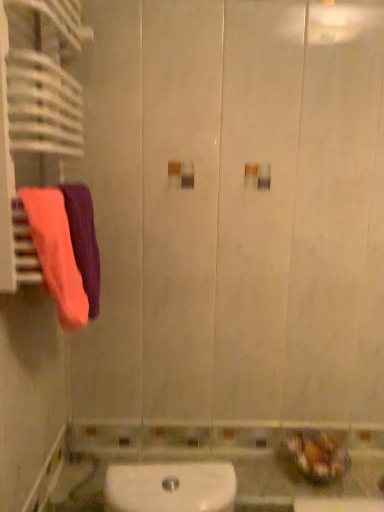
Image resolution: width=384 pixels, height=512 pixels. What do you see at coordinates (56, 254) in the screenshot?
I see `fluffy cotton towel at left, arranged as the first towel when viewed from the front` at bounding box center [56, 254].

At what (x,y) coordinates should I click in order to perform the action: click on fluffy cotton towel at left, arranged as the first towel when viewed from the front. Please return your answer as a coordinate pair (x, y). This screenshot has height=512, width=384. Looking at the image, I should click on (56, 254).

Where is `orange fabric towel at left, arranged as the 1th towel when viewed from the back`? Image resolution: width=384 pixels, height=512 pixels. orange fabric towel at left, arranged as the 1th towel when viewed from the back is located at coordinates (84, 240).

What do you see at coordinates (84, 240) in the screenshot? I see `orange fabric towel at left, the second towel viewed from the front` at bounding box center [84, 240].

In order to click on fluffy cotton towel at left, which is counted as the second towel, starting from the back in this screenshot , I will do `click(56, 254)`.

Is fluffy cotton towel at left, which is counted as the second towel, starting from the back, at the left side of orange fabric towel at left, arranged as the 1th towel when viewed from the back?

Indeed, fluffy cotton towel at left, which is counted as the second towel, starting from the back, is positioned on the left side of orange fabric towel at left, arranged as the 1th towel when viewed from the back.

From the picture: Is fluffy cotton towel at left, which is counted as the second towel, starting from the back, further to the viewer compared to orange fabric towel at left, the second towel viewed from the front?

No, fluffy cotton towel at left, which is counted as the second towel, starting from the back, is in front of orange fabric towel at left, the second towel viewed from the front.

Is point (44, 200) closer to viewer compared to point (78, 221)?

Yes, it is.

From the image's perspective, which is above, fluffy cotton towel at left, which is counted as the second towel, starting from the back, or orange fabric towel at left, arranged as the 1th towel when viewed from the back?

orange fabric towel at left, arranged as the 1th towel when viewed from the back, appears higher in the image.

In the scene shown: From a real-world perspective, is fluffy cotton towel at left, which is counted as the second towel, starting from the back, positioned under orange fabric towel at left, arranged as the 1th towel when viewed from the back, based on gravity?

Actually, fluffy cotton towel at left, which is counted as the second towel, starting from the back, is physically above orange fabric towel at left, arranged as the 1th towel when viewed from the back, in the real world.

Is fluffy cotton towel at left, which is counted as the second towel, starting from the back, wider or thinner than orange fabric towel at left, arranged as the 1th towel when viewed from the back?

Clearly, fluffy cotton towel at left, which is counted as the second towel, starting from the back, has less width compared to orange fabric towel at left, arranged as the 1th towel when viewed from the back.

In terms of height, does fluffy cotton towel at left, arranged as the first towel when viewed from the front, look taller or shorter compared to orange fabric towel at left, arranged as the 1th towel when viewed from the back?

fluffy cotton towel at left, arranged as the first towel when viewed from the front, is shorter than orange fabric towel at left, arranged as the 1th towel when viewed from the back.

Consider the image. Is fluffy cotton towel at left, which is counted as the second towel, starting from the back, bigger or smaller than orange fabric towel at left, arranged as the 1th towel when viewed from the back?

Clearly, fluffy cotton towel at left, which is counted as the second towel, starting from the back, is smaller in size than orange fabric towel at left, arranged as the 1th towel when viewed from the back.

Would you say fluffy cotton towel at left, arranged as the first towel when viewed from the front, is inside or outside orange fabric towel at left, arranged as the 1th towel when viewed from the back?

The correct answer is: inside.

Is fluffy cotton towel at left, which is counted as the second towel, starting from the back, positioned far away from orange fabric towel at left, arranged as the 1th towel when viewed from the back?

Actually, fluffy cotton towel at left, which is counted as the second towel, starting from the back, and orange fabric towel at left, arranged as the 1th towel when viewed from the back, are a little close together.

Is orange fabric towel at left, the second towel viewed from the front, at the back of fluffy cotton towel at left, which is counted as the second towel, starting from the back?

fluffy cotton towel at left, which is counted as the second towel, starting from the back, is not turned away from orange fabric towel at left, the second towel viewed from the front.

How many degrees apart are the facing directions of fluffy cotton towel at left, arranged as the first towel when viewed from the front, and orange fabric towel at left, arranged as the 1th towel when viewed from the back?

fluffy cotton towel at left, arranged as the first towel when viewed from the front, and orange fabric towel at left, arranged as the 1th towel when viewed from the back, are facing 0.000263 degrees away from each other.

Measure the distance from fluffy cotton towel at left, which is counted as the second towel, starting from the back, to orange fabric towel at left, arranged as the 1th towel when viewed from the back.

fluffy cotton towel at left, which is counted as the second towel, starting from the back, and orange fabric towel at left, arranged as the 1th towel when viewed from the back, are 6.09 centimeters apart.

Where is `towel lying above the fluffy cotton towel at left, arranged as the first towel when viewed from the front (from the image's perspective)`? The image size is (384, 512). towel lying above the fluffy cotton towel at left, arranged as the first towel when viewed from the front (from the image's perspective) is located at coordinates (84, 240).

Can you confirm if orange fabric towel at left, the second towel viewed from the front, is positioned to the left of fluffy cotton towel at left, which is counted as the second towel, starting from the back?

Incorrect, orange fabric towel at left, the second towel viewed from the front, is not on the left side of fluffy cotton towel at left, which is counted as the second towel, starting from the back.

Which object is closer to the camera taking this photo, orange fabric towel at left, arranged as the 1th towel when viewed from the back, or fluffy cotton towel at left, which is counted as the second towel, starting from the back?

fluffy cotton towel at left, which is counted as the second towel, starting from the back, is in front.

Considering the points (76, 193) and (45, 227), which point is behind, point (76, 193) or point (45, 227)?

The point (76, 193) is more distant.

From the image's perspective, between orange fabric towel at left, arranged as the 1th towel when viewed from the back, and fluffy cotton towel at left, which is counted as the second towel, starting from the back, which one is located above?

From the image's view, orange fabric towel at left, arranged as the 1th towel when viewed from the back, is above.

From the picture: From a real-world perspective, is orange fabric towel at left, the second towel viewed from the front, positioned above or below fluffy cotton towel at left, arranged as the first towel when viewed from the front?

Clearly, from a real-world perspective, orange fabric towel at left, the second towel viewed from the front, is below fluffy cotton towel at left, arranged as the first towel when viewed from the front.

Between orange fabric towel at left, the second towel viewed from the front, and fluffy cotton towel at left, arranged as the first towel when viewed from the front, which one has smaller width?

fluffy cotton towel at left, arranged as the first towel when viewed from the front, is thinner.

Considering the relative sizes of orange fabric towel at left, the second towel viewed from the front, and fluffy cotton towel at left, arranged as the first towel when viewed from the front, in the image provided, is orange fabric towel at left, the second towel viewed from the front, taller than fluffy cotton towel at left, arranged as the first towel when viewed from the front,?

Correct, orange fabric towel at left, the second towel viewed from the front, is much taller as fluffy cotton towel at left, arranged as the first towel when viewed from the front.

Is orange fabric towel at left, arranged as the 1th towel when viewed from the back, bigger than fluffy cotton towel at left, arranged as the first towel when viewed from the front?

Yes, orange fabric towel at left, arranged as the 1th towel when viewed from the back, is bigger than fluffy cotton towel at left, arranged as the first towel when viewed from the front.

Is orange fabric towel at left, the second towel viewed from the front, inside or outside of fluffy cotton towel at left, arranged as the first towel when viewed from the front?

orange fabric towel at left, the second towel viewed from the front, lies outside fluffy cotton towel at left, arranged as the first towel when viewed from the front.

Does orange fabric towel at left, arranged as the 1th towel when viewed from the back, touch fluffy cotton towel at left, which is counted as the second towel, starting from the back?

Indeed, orange fabric towel at left, arranged as the 1th towel when viewed from the back, and fluffy cotton towel at left, which is counted as the second towel, starting from the back, are beside each other and touching.

Is orange fabric towel at left, the second towel viewed from the front, oriented towards fluffy cotton towel at left, arranged as the first towel when viewed from the front?

No, orange fabric towel at left, the second towel viewed from the front, is not aimed at fluffy cotton towel at left, arranged as the first towel when viewed from the front.

What's the angular difference between orange fabric towel at left, the second towel viewed from the front, and fluffy cotton towel at left, arranged as the first towel when viewed from the front,'s facing directions?

They differ by 0.000263 degrees in their facing directions.

Could you measure the distance between orange fabric towel at left, the second towel viewed from the front, and fluffy cotton towel at left, arranged as the first towel when viewed from the front?

2.40 inches.

You are a GUI agent. You are given a task and a screenshot of the screen. Output one action in this format:
    pyautogui.click(x=<x>, y=<y>)
    Task: Click on the towel above the fluffy cotton towel at left, arranged as the first towel when viewed from the front (from the image's perspective)
    
    Given the screenshot: What is the action you would take?
    pyautogui.click(x=84, y=240)

Where is `towel behind the fluffy cotton towel at left, arranged as the first towel when viewed from the front`? The width and height of the screenshot is (384, 512). towel behind the fluffy cotton towel at left, arranged as the first towel when viewed from the front is located at coordinates (84, 240).

Identify the location of towel above the orange fabric towel at left, the second towel viewed from the front (from a real-world perspective). (56, 254).